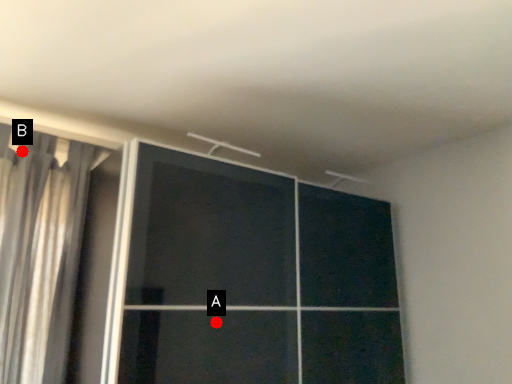
Question: Two points are circled on the image, labeled by A and B beside each circle. Which point appears farthest from the camera in this image?

Choices:
 (A) A is further
 (B) B is further

Answer: (B)